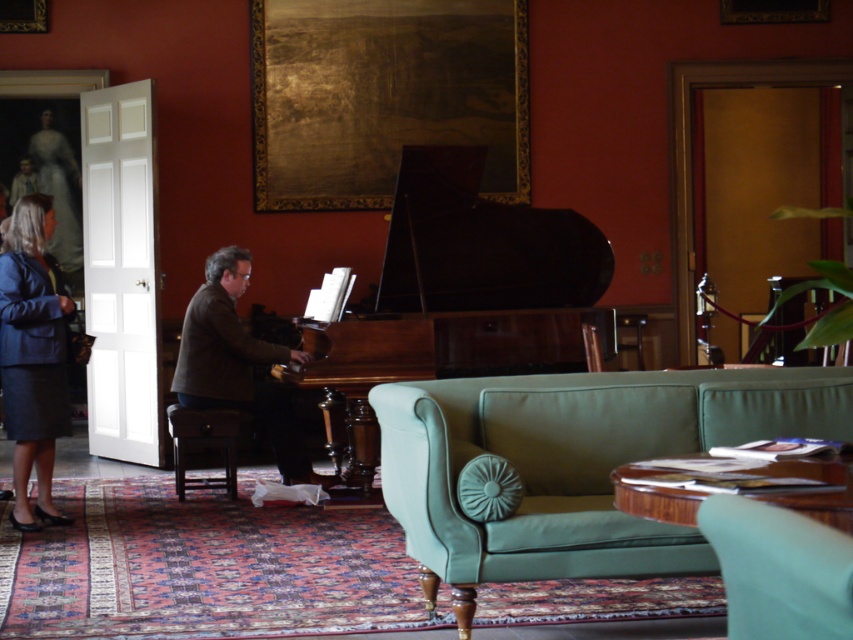
You are organizing a fashion show and need to place the matte blue skirt at left and brown leather jacket at center in a straight line. Which item should you move to the right to align them properly?

The matte blue skirt at left is to the left of the brown leather jacket at center. To align them in a straight line, you should move the brown leather jacket at center to the left so that both items are positioned side by side.

You are standing in the room and want to walk straight towards the shiny polished wood piano at center. If your walking speed is 1.2 meters per second, how many seconds will it take you to reach the piano?

The distance between you and the shiny polished wood piano at center is 6.86 meters. At a speed of 1.2 meters per second, dividing the distance by the speed gives approximately 5.72 seconds. Therefore, it will take about 5.72 seconds to reach the piano.

You are a guest in the room and want to sit on the matte blue skirt at left. However, you notice the wooden piano at center is in the way. Can you easily walk around the piano to reach the skirt?

The matte blue skirt at left is taller than wooden piano at center, so the skirt is taller than the piano. However, the piano is an obstacle between you and the skirt. Since the skirt is taller than the piano, it might block your view, but you can still walk around the piano to reach the skirt as the height difference doesn